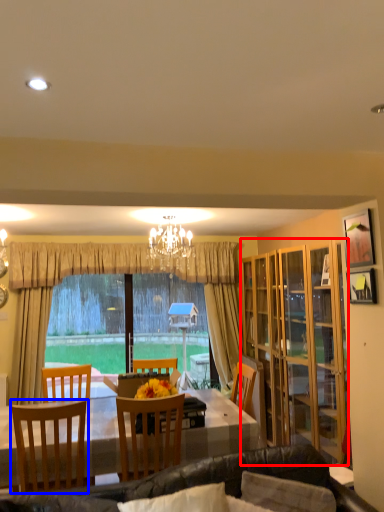
Question: Which object is further to the camera taking this photo, cabinetry (highlighted by a red box) or chair (highlighted by a blue box)?

Choices:
 (A) cabinetry
 (B) chair

Answer: (A)